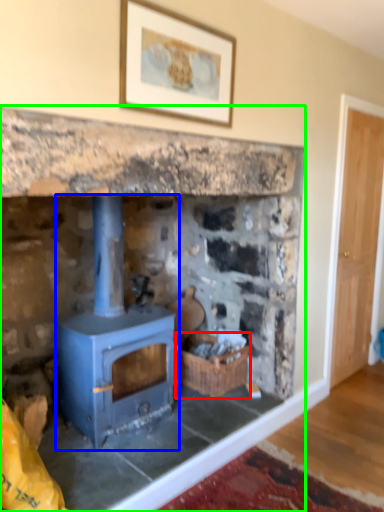
Question: Based on their relative distances, which object is farther from basket (highlighted by a red box)? Choose from wood burning stove (highlighted by a blue box) and fireplace (highlighted by a green box).

Choices:
 (A) wood burning stove
 (B) fireplace

Answer: (A)